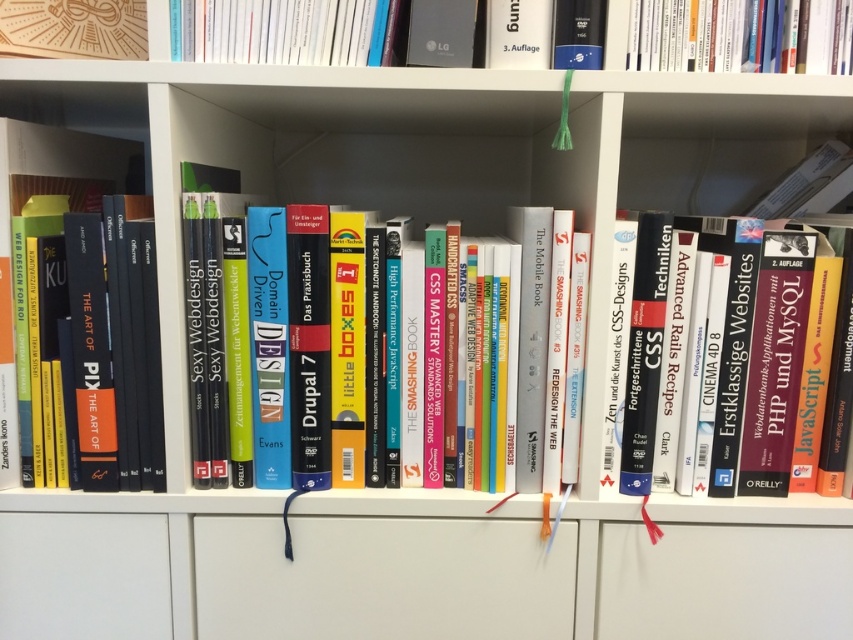
Question: Among these points, which one is farthest from the camera?

Choices:
 (A) (451, 474)
 (B) (132, 170)
 (C) (711, 336)
 (D) (289, 35)

Answer: (B)

Question: Can you confirm if hardcover book at upper center is positioned to the left of hardcover books at center?

Choices:
 (A) no
 (B) yes

Answer: (A)

Question: Does hardcover book at upper center appear on the right side of matte black book at left?

Choices:
 (A) no
 (B) yes

Answer: (B)

Question: Can you confirm if hardcover book at center is wider than hardcover book at upper right?

Choices:
 (A) no
 (B) yes

Answer: (B)

Question: Which object is farther from the camera taking this photo?

Choices:
 (A) hardcover book at center
 (B) matte black book at left

Answer: (A)

Question: Considering the real-world distances, which object is farthest from the hardcover books at center?

Choices:
 (A) hardcover book at upper right
 (B) hardcover book at center
 (C) hardcover book at upper center
 (D) matte black book at left

Answer: (A)